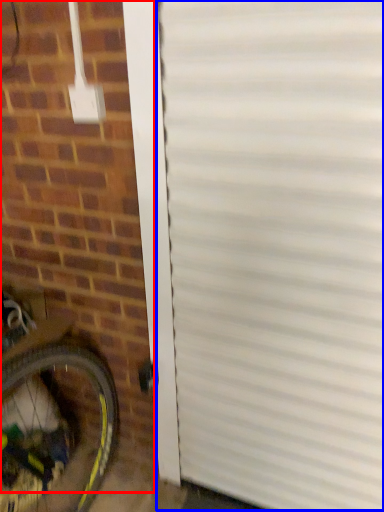
Question: Which point is further to the camera, brickwork (highlighted by a red box) or garage door (highlighted by a blue box)?

Choices:
 (A) brickwork
 (B) garage door

Answer: (B)